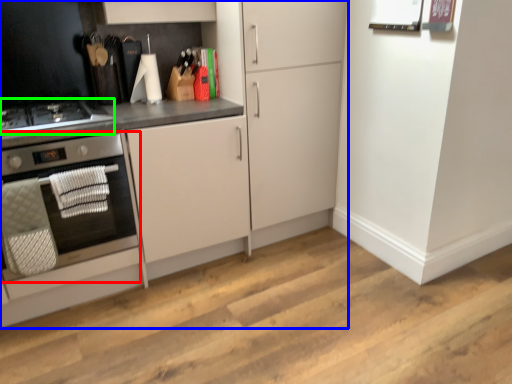
Question: Considering the real-world distances, which object is closest to home appliance (highlighted by a red box)? cabinetry (highlighted by a blue box) or gas stove (highlighted by a green box).

Choices:
 (A) cabinetry
 (B) gas stove

Answer: (B)